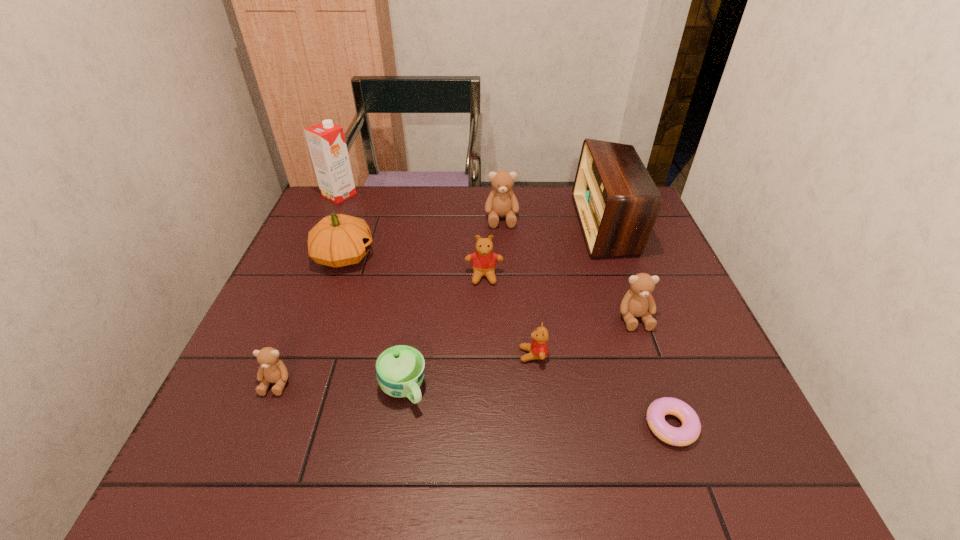
The height and width of the screenshot is (540, 960). I want to click on object that is at the far left corner, so click(x=326, y=141).

Find the location of a particular element. This screenshot has height=540, width=960. object at the far right corner is located at coordinates (617, 202).

The width and height of the screenshot is (960, 540). Identify the location of object positioned at the near right corner. (688, 433).

Identify the location of free space at the far edge of the desktop. (424, 188).

In the image, there is a desktop. Where is `vacant space at the near edge`? The height and width of the screenshot is (540, 960). vacant space at the near edge is located at coordinates (559, 477).

Where is `vacant space at the left edge of the desktop`? vacant space at the left edge of the desktop is located at coordinates (324, 279).

At what (x,y) coordinates should I click in order to perform the action: click on vacant space at the right edge of the desktop. Please return your answer as a coordinate pair (x, y). Looking at the image, I should click on (663, 391).

The width and height of the screenshot is (960, 540). I want to click on blank space at the near left corner of the desktop, so click(242, 484).

You are a GUI agent. You are given a task and a screenshot of the screen. Output one action in this format:
    pyautogui.click(x=<x>, y=<y>)
    Task: Click on the vacant space that's between the fourth nearest teddy bear and the shortest object
    The height and width of the screenshot is (540, 960).
    Given the screenshot: What is the action you would take?
    pyautogui.click(x=577, y=350)

Where is `vacant space in between the second nearest brown teddy bear and the orange gourd`? The width and height of the screenshot is (960, 540). vacant space in between the second nearest brown teddy bear and the orange gourd is located at coordinates (490, 287).